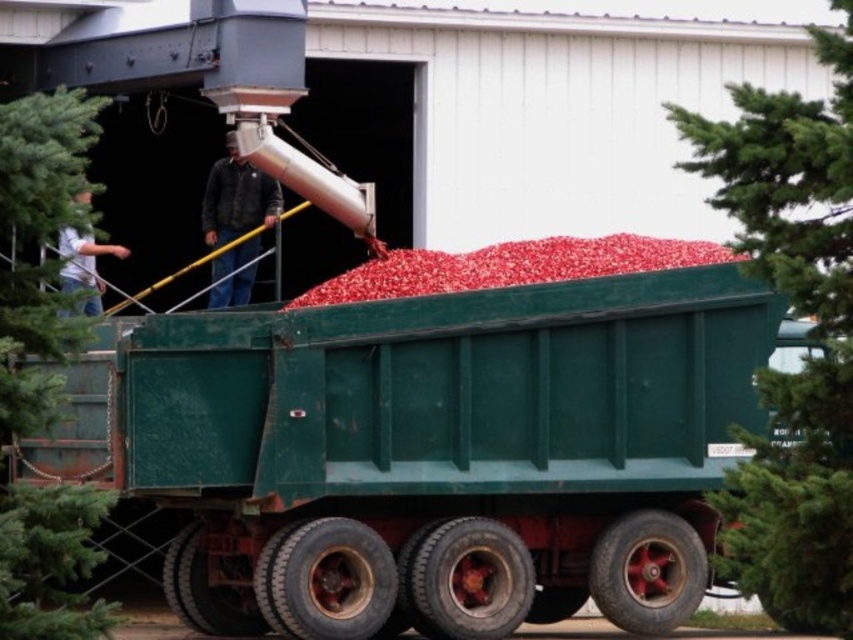
Is green matte truck at center closer to the viewer compared to green textured tree at lower right?

No, it is not.

Does green matte truck at center have a larger size compared to green textured tree at lower right?

No.

Does point (263, 499) come farther from viewer compared to point (776, 556)?

That is True.

Where is `green matte truck at center`? green matte truck at center is located at coordinates (436, 444).

Is green textured tree at lower right above green textured tree at left?

Indeed, green textured tree at lower right is positioned over green textured tree at left.

Is green textured tree at lower right positioned before green textured tree at left?

That is True.

Which is in front, point (759, 202) or point (26, 305)?

Point (26, 305)

The image size is (853, 640). I want to click on green textured tree at lower right, so (x=813, y=326).

Which is in front, point (30, 380) or point (254, 168)?

Point (30, 380) is in front.

Describe the element at coordinates (38, 248) in the screenshot. The width and height of the screenshot is (853, 640). I see `green textured tree at left` at that location.

Where is `green textured tree at left`? green textured tree at left is located at coordinates (38, 248).